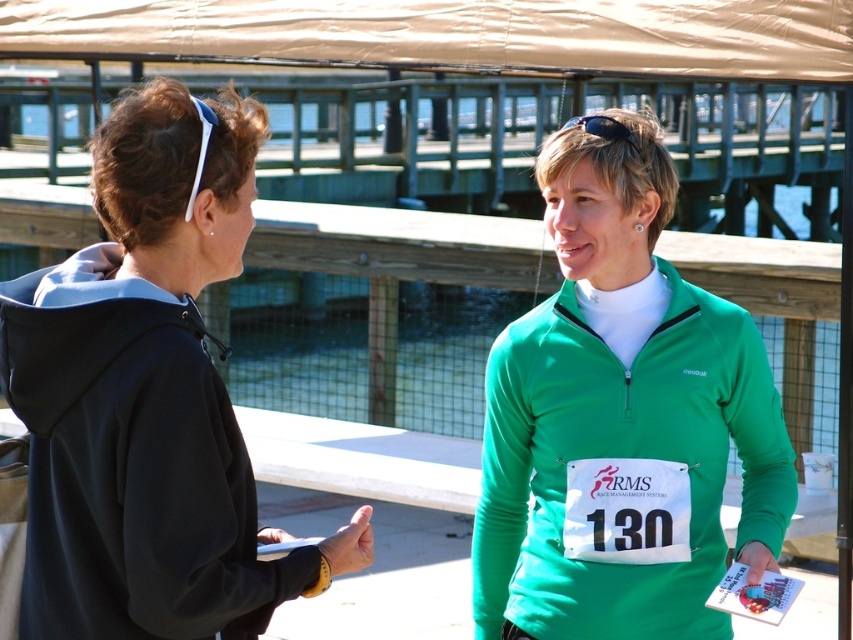
Who is more distant from viewer, (114, 636) or (561, 392)?

The point (561, 392) is behind.

Is point (169, 445) farther from viewer compared to point (548, 477)?

No, it is not.

Find the location of a particular element. matte black hoodie at left is located at coordinates (148, 397).